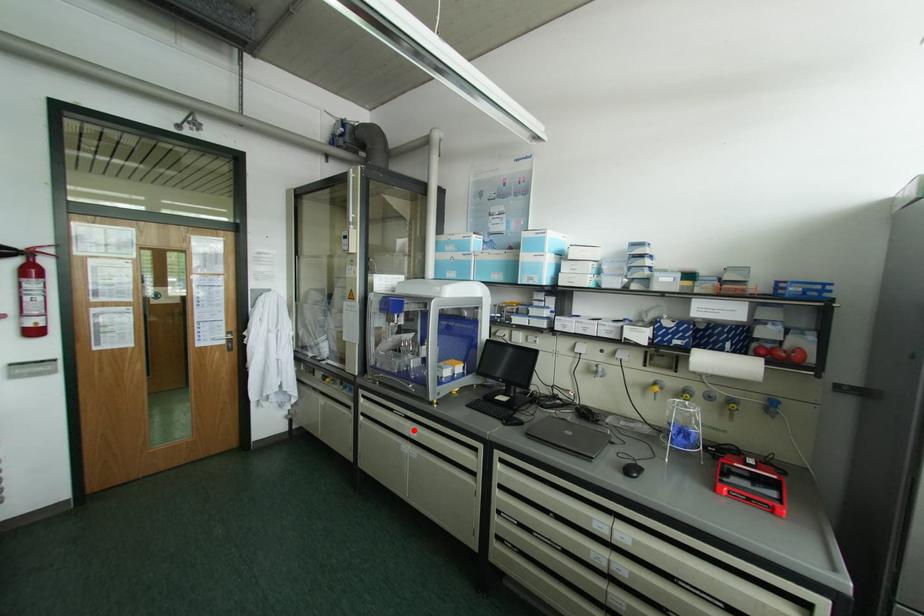
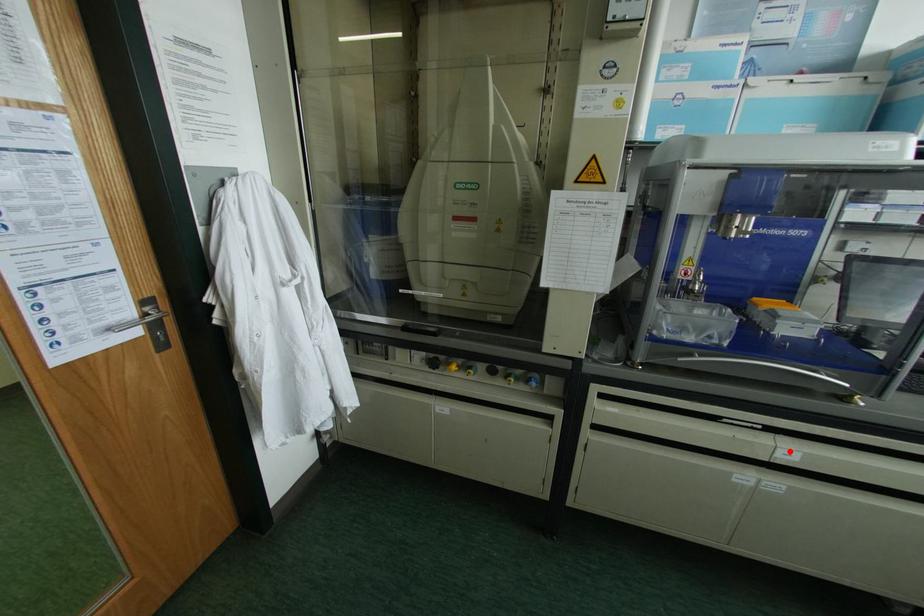
Looking at this image, I am providing you with two images of the same scene from different viewpoints. A red point is marked on the first image and another point is marked on the second image. Is the marked point in image1 the same physical position as the marked point in image2?

Yes